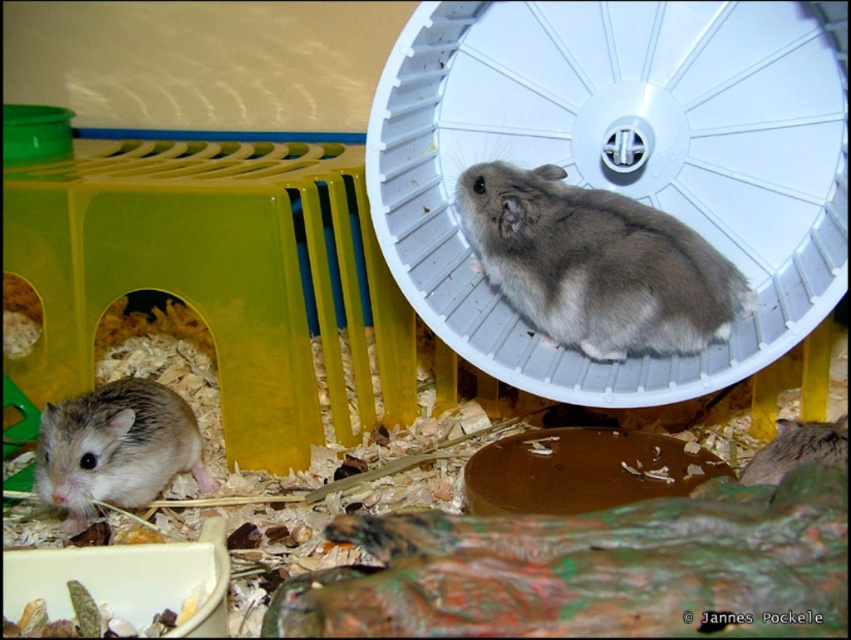
Question: Does fuzzy gray hamster at center have a lesser width compared to brown fuzzy hamster at lower left?

Choices:
 (A) yes
 (B) no

Answer: (B)

Question: Which point is closer to the camera?

Choices:
 (A) (495, 195)
 (B) (133, 408)

Answer: (B)

Question: Is fuzzy gray hamster at center smaller than brown fuzzy hamster at lower left?

Choices:
 (A) yes
 (B) no

Answer: (B)

Question: Which point is farther to the camera?

Choices:
 (A) brown fuzzy hamster at lower left
 (B) fuzzy gray hamster at center

Answer: (B)

Question: Can you confirm if fuzzy gray hamster at center is smaller than brown fuzzy hamster at lower left?

Choices:
 (A) yes
 (B) no

Answer: (B)